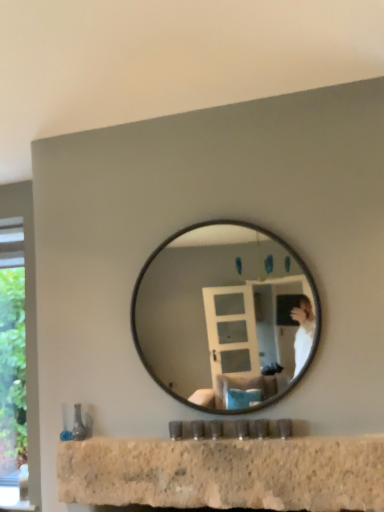
Locate an element on the screen. free space above black glass mirror at center (from a real-world perspective) is located at coordinates (217, 219).